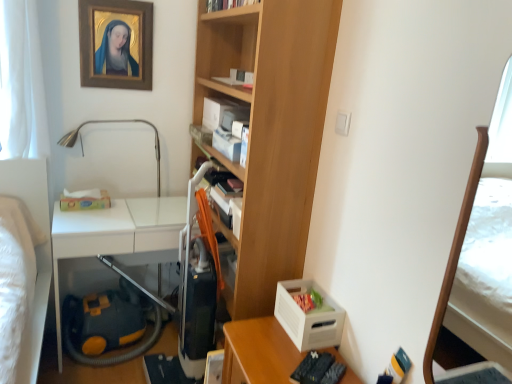
Question: Would you say wooden bookcase at center is to the left or to the right of wooden picture frame at upper left in the picture?

Choices:
 (A) right
 (B) left

Answer: (A)

Question: Considering their positions, is wooden bookcase at center located in front of or behind wooden picture frame at upper left?

Choices:
 (A) behind
 (B) front

Answer: (B)

Question: Based on their relative distances, which object is nearer to the wooden bookcase at center?

Choices:
 (A) white sheer curtain at left
 (B) wooden picture frame at upper left
 (C) wooden desk at lower right
 (D) yellow-orange plastic vacuum cleaner at lower left

Answer: (C)

Question: Based on their relative distances, which object is farther from the yellow-orange plastic vacuum cleaner at lower left?

Choices:
 (A) white sheer curtain at left
 (B) wooden bookcase at center
 (C) wooden picture frame at upper left
 (D) wooden desk at lower right

Answer: (C)